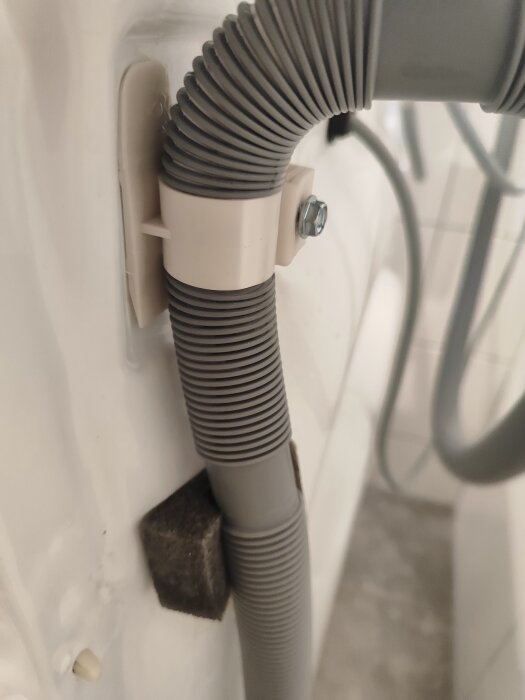
At what (x,y) coordinates should I click in order to perform the action: click on wall. Please return your answer as a coordinate pair (x, y). Looking at the image, I should click on (311, 449).